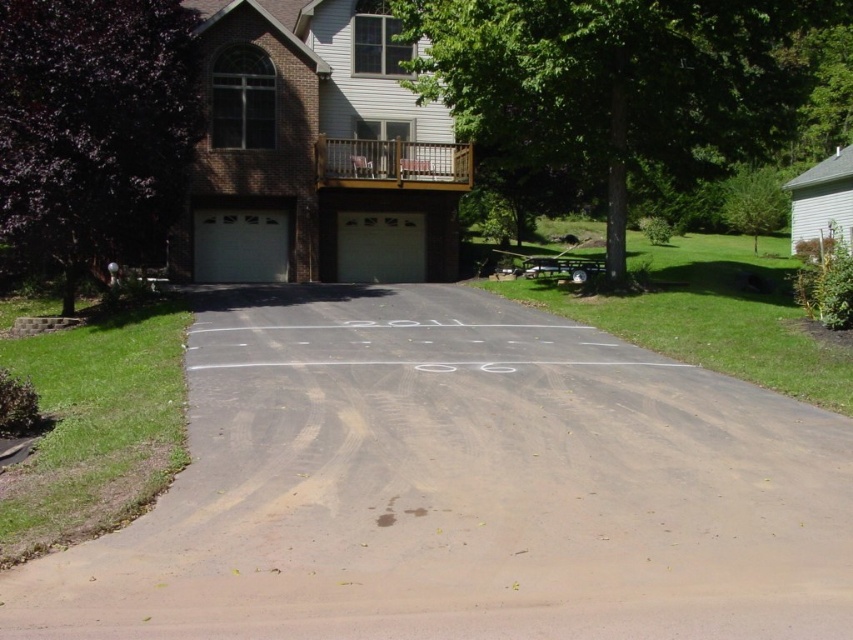
Question: Which point is closer to the camera taking this photo?

Choices:
 (A) click(393, 214)
 (B) click(282, 246)
 (C) click(277, 236)
 (D) click(50, 592)

Answer: (D)

Question: Which of the following is the closest to the observer?

Choices:
 (A) (231, 268)
 (B) (100, 35)
 (C) (225, 280)
 (D) (512, 76)

Answer: (B)

Question: Can you confirm if brown asphalt driveway at center is positioned to the left of purple leafy tree at left?

Choices:
 (A) no
 (B) yes

Answer: (A)

Question: Which point is farther from the camera taking this photo?

Choices:
 (A) (199, 232)
 (B) (160, 232)
 (C) (248, 230)

Answer: (C)

Question: Is brown asphalt driveway at center below purple leafy tree at left?

Choices:
 (A) yes
 (B) no

Answer: (A)

Question: Considering the relative positions of white smooth garage at upper center and white smooth garage door at center in the image provided, where is white smooth garage at upper center located with respect to white smooth garage door at center?

Choices:
 (A) right
 (B) left

Answer: (B)